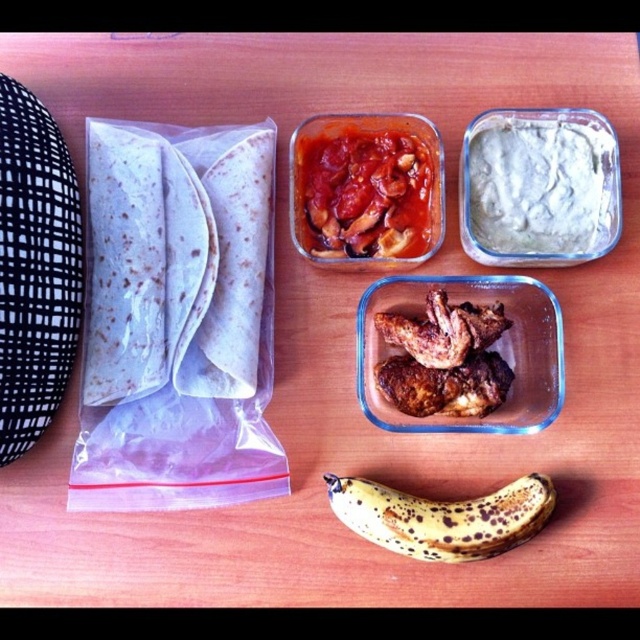
Question: Among these points, which one is nearest to the camera?

Choices:
 (A) (129, 195)
 (B) (524, 504)

Answer: (B)

Question: Observing the image, what is the correct spatial positioning of green creamy dip at upper right in reference to tomato-based sauce at center?

Choices:
 (A) left
 (B) right

Answer: (B)

Question: Which object appears closest to the camera in this image?

Choices:
 (A) green creamy dip at upper right
 (B) white flour tortillas at left

Answer: (A)

Question: Does white flour tortillas at left have a lesser width compared to green creamy dip at upper right?

Choices:
 (A) no
 (B) yes

Answer: (A)

Question: Is green creamy dip at upper right in front of tomato-based sauce at center?

Choices:
 (A) no
 (B) yes

Answer: (B)

Question: Which point appears farthest from the camera in this image?

Choices:
 (A) (465, 540)
 (B) (321, 236)
 (C) (493, 262)

Answer: (B)